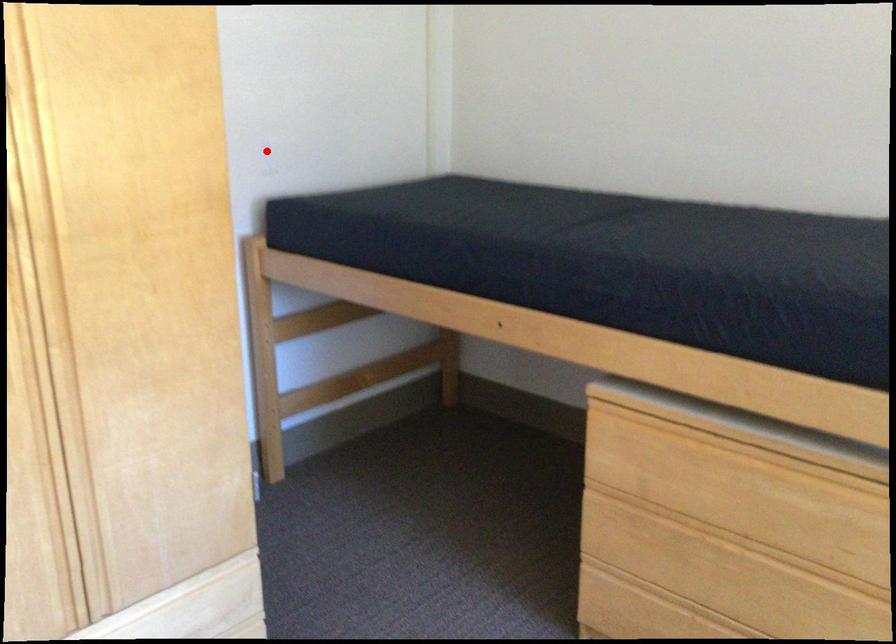
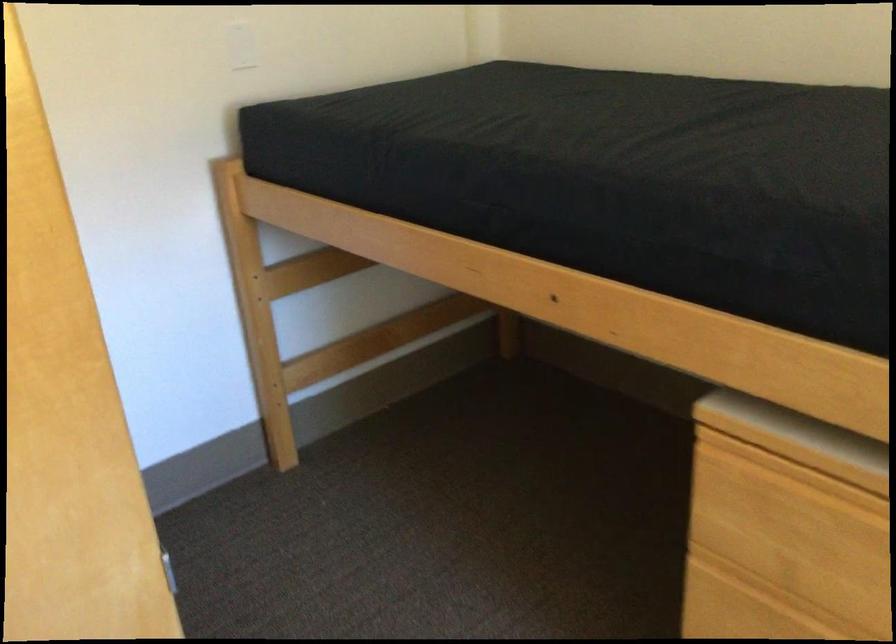
Find the pixel in the second image that matches the highlighted location in the first image.

(239, 44)